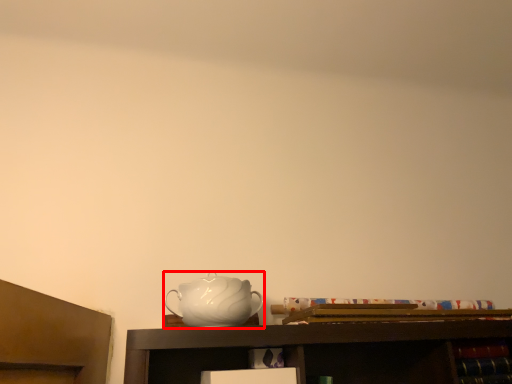
Question: From the image's perspective, what is the correct spatial positioning of jug (annotated by the red box) in reference to cabinet?

Choices:
 (A) below
 (B) above

Answer: (B)